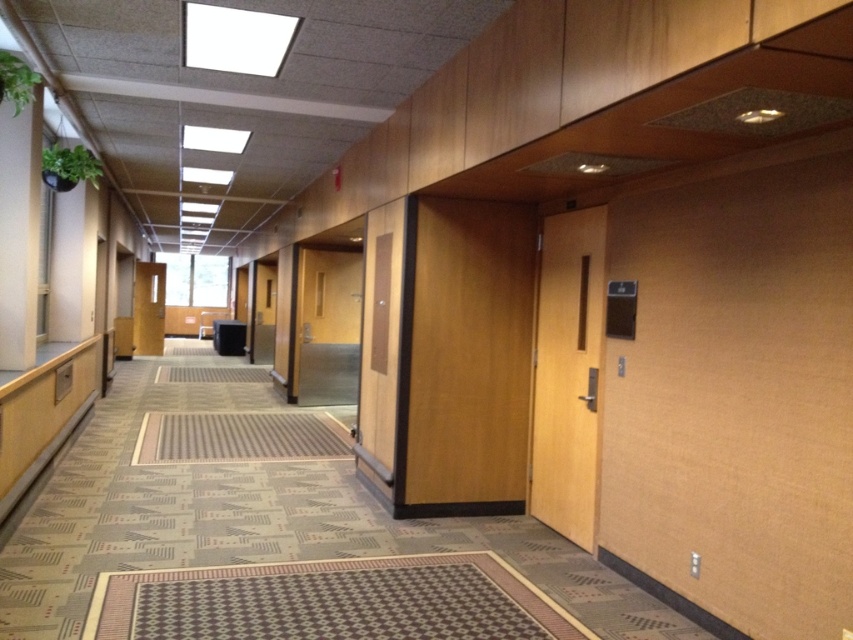
Is point (404, 368) behind point (549, 336)?

Yes, it is.

Does wooden door at center have a lesser height compared to light brown wood door at center-right?

No, wooden door at center is not shorter than light brown wood door at center-right.

Between point (447, 342) and point (602, 244), which one is positioned in front?

Point (602, 244)

At what (x,y) coordinates should I click in order to perform the action: click on wooden door at center. Please return your answer as a coordinate pair (x, y). This screenshot has width=853, height=640. Looking at the image, I should click on coord(463,356).